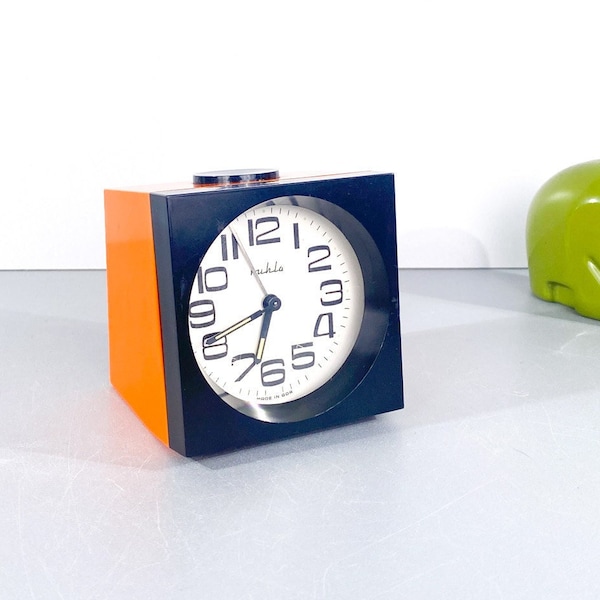
Locate an element on the screen. clock is located at coordinates (141, 322).